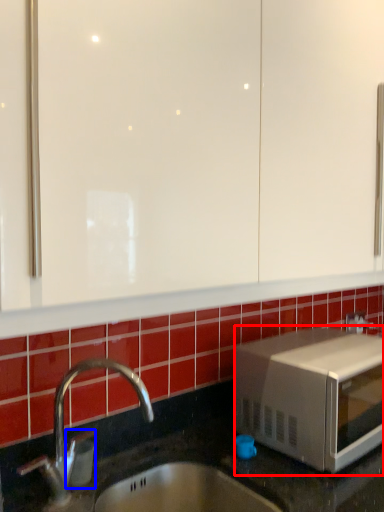
Question: Which object is closer to the camera taking this photo, microwave oven (highlighted by a red box) or soap dispenser (highlighted by a blue box)?

Choices:
 (A) microwave oven
 (B) soap dispenser

Answer: (B)